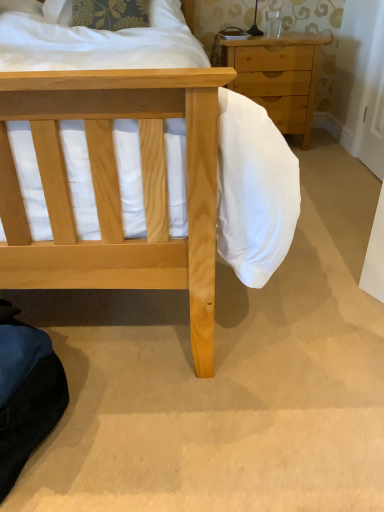
Question: Is light wood/texture chest of drawers at upper right completely or partially outside of white fabric pillow at upper left?

Choices:
 (A) no
 (B) yes

Answer: (B)

Question: Considering the relative sizes of light wood/texture chest of drawers at upper right and white fabric pillow at upper left in the image provided, is light wood/texture chest of drawers at upper right thinner than white fabric pillow at upper left?

Choices:
 (A) yes
 (B) no

Answer: (B)

Question: From the image's perspective, is light wood/texture chest of drawers at upper right below white fabric pillow at upper left?

Choices:
 (A) yes
 (B) no

Answer: (A)

Question: Could you tell me if light wood/texture chest of drawers at upper right is turned towards white fabric pillow at upper left?

Choices:
 (A) no
 (B) yes

Answer: (A)

Question: Considering the relative sizes of light wood/texture chest of drawers at upper right and white fabric pillow at upper left in the image provided, is light wood/texture chest of drawers at upper right wider than white fabric pillow at upper left?

Choices:
 (A) yes
 (B) no

Answer: (A)

Question: Is light wood/texture chest of drawers at upper right beside white fabric pillow at upper left?

Choices:
 (A) yes
 (B) no

Answer: (B)

Question: From the image's perspective, does white fabric pillow at upper left appear higher than light wood/texture chest of drawers at upper right?

Choices:
 (A) yes
 (B) no

Answer: (A)

Question: Is the position of white fabric pillow at upper left more distant than that of light wood/texture chest of drawers at upper right?

Choices:
 (A) yes
 (B) no

Answer: (B)

Question: Would you say light wood/texture chest of drawers at upper right is part of white fabric pillow at upper left's contents?

Choices:
 (A) no
 (B) yes

Answer: (A)

Question: Is white fabric pillow at upper left to the right of light wood/texture chest of drawers at upper right from the viewer's perspective?

Choices:
 (A) no
 (B) yes

Answer: (A)

Question: Would you say white fabric pillow at upper left is outside light wood/texture chest of drawers at upper right?

Choices:
 (A) yes
 (B) no

Answer: (A)

Question: Can you confirm if white fabric pillow at upper left is taller than light wood/texture chest of drawers at upper right?

Choices:
 (A) no
 (B) yes

Answer: (A)

Question: Looking at the image, does light wood/texture chest of drawers at upper right seem bigger or smaller compared to white fabric pillow at upper left?

Choices:
 (A) small
 (B) big

Answer: (B)